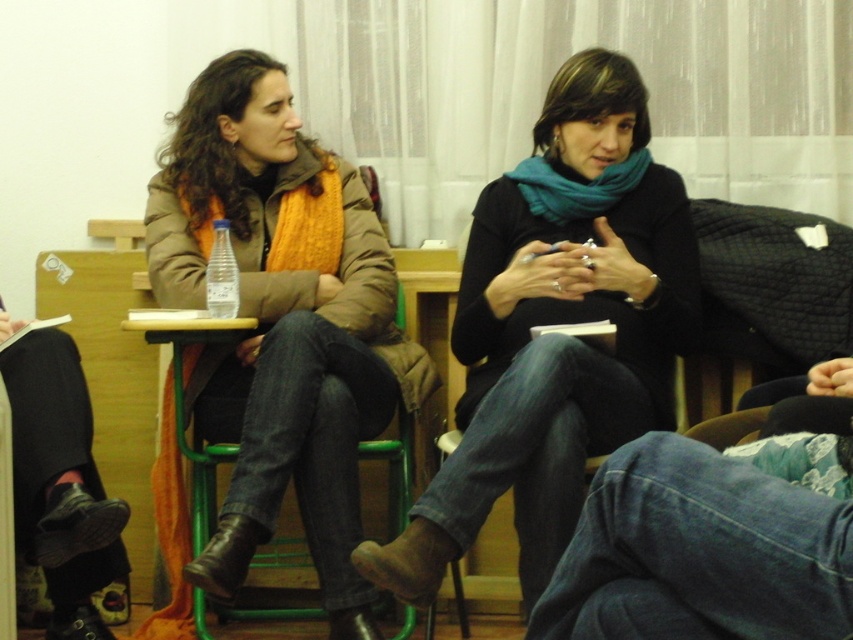
You are standing at the origin point in the room. You need to move to the green metal chair at center. Which direction should you move in to reach it?

The green metal chair at center is located at point 0.733 on the x axis and 0.233 on the y axis. Since you are at the origin, you should move towards the positive x and positive y direction to reach it.

You are a person sitting on the green metal chair at center. You want to pick up the clear plastic bottle at center. Is the bottle within your reach?

The green metal chair at center is below the clear plastic bottle at center, so the bottle is likely within your reach if you can extend your arm upwards.